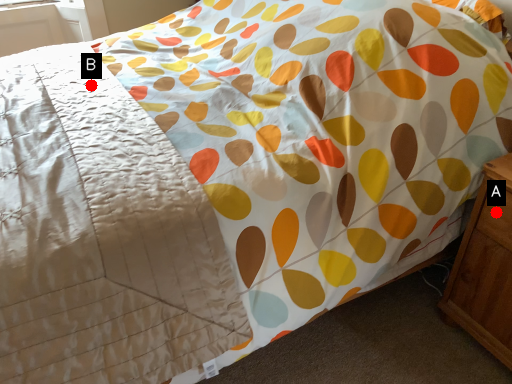
Question: Two points are circled on the image, labeled by A and B beside each circle. Which point is further to the camera?

Choices:
 (A) A is further
 (B) B is further

Answer: (B)